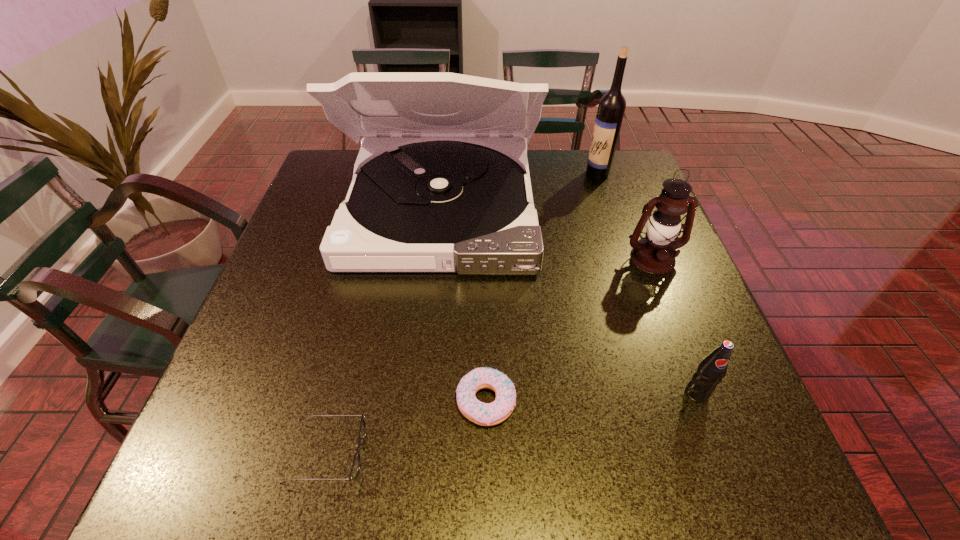
What are the coordinates of `pop that is at the right edge` in the screenshot? It's located at (710, 371).

You are a GUI agent. You are given a task and a screenshot of the screen. Output one action in this format:
    pyautogui.click(x=<x>, y=<y>)
    Task: Click on the object located in the far left corner section of the desktop
    This screenshot has width=960, height=540.
    Given the screenshot: What is the action you would take?
    click(435, 189)

Find the location of `object located in the far right corner section of the desktop`. object located in the far right corner section of the desktop is located at coordinates (611, 108).

Locate an element on the screen. The image size is (960, 540). vacant region at the far edge is located at coordinates (554, 180).

Locate an element on the screen. vacant space at the near edge is located at coordinates (499, 467).

Where is `free region at the left edge of the desktop`? The image size is (960, 540). free region at the left edge of the desktop is located at coordinates (307, 297).

You are a GUI agent. You are given a task and a screenshot of the screen. Output one action in this format:
    pyautogui.click(x=<x>, y=<y>)
    Task: Click on the vacant space at the right edge of the desktop
    The image size is (960, 540).
    Given the screenshot: What is the action you would take?
    pyautogui.click(x=618, y=272)

This screenshot has width=960, height=540. In the image, there is a desktop. What are the coordinates of `vacant space at the far left corner` in the screenshot? It's located at (331, 181).

In order to click on vacant space at the near left corner of the desktop in this screenshot , I will do `click(267, 478)`.

Where is `unoccupied area between the fourth tallest object and the CD player`? unoccupied area between the fourth tallest object and the CD player is located at coordinates (568, 300).